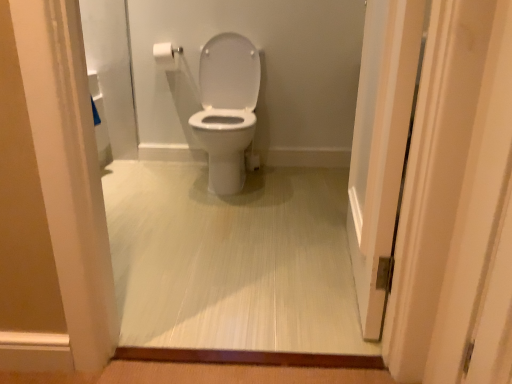
In order to click on free space to the left of white glossy toilet at center in this screenshot , I will do `click(161, 176)`.